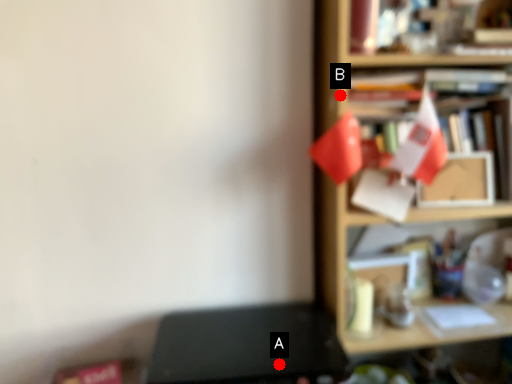
Question: Two points are circled on the image, labeled by A and B beside each circle. Which point appears closest to the camera in this image?

Choices:
 (A) A is closer
 (B) B is closer

Answer: (B)